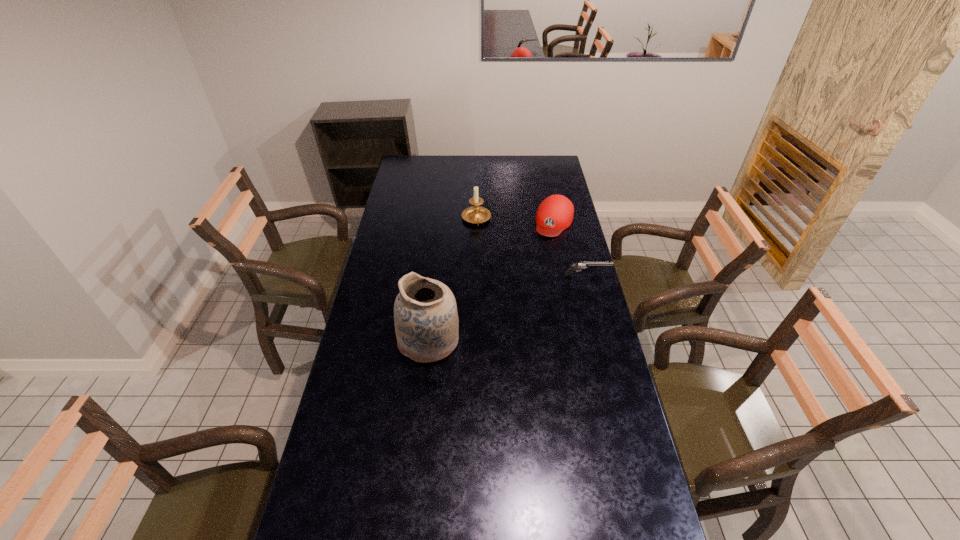
Find the location of `the tallest object`. the tallest object is located at coordinates (426, 321).

Find the location of a particular element. Image resolution: width=960 pixels, height=540 pixels. the nearest object is located at coordinates (426, 321).

Locate an element on the screen. Image resolution: width=960 pixels, height=540 pixels. pistol is located at coordinates (581, 265).

The height and width of the screenshot is (540, 960). Identify the location of the shortest object. (581, 265).

Identify the location of baseball cap. This screenshot has width=960, height=540. (555, 213).

Find the location of a particular element. The height and width of the screenshot is (540, 960). candle holder is located at coordinates (476, 214).

I want to click on vacant area located 0.370m on the front of the nearest object, so click(414, 476).

This screenshot has height=540, width=960. What are the coordinates of `free space located 0.110m on the front-facing side of the baseball cap` in the screenshot? It's located at (543, 252).

Identify the location of vacant area located 0.250m on the front-facing side of the baseball cap. (534, 271).

At what (x,y) coordinates should I click in order to perform the action: click on free space located on the front-facing side of the baseball cap. Please return your answer as a coordinate pair (x, y). This screenshot has height=540, width=960. Looking at the image, I should click on (540, 258).